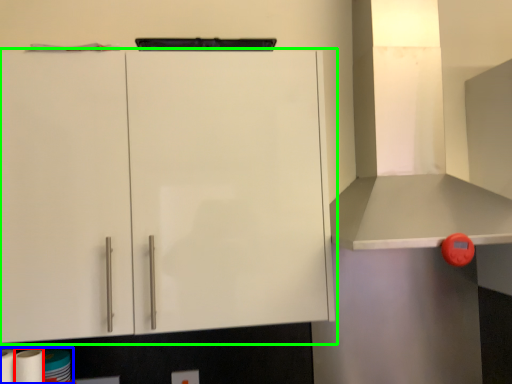
Question: Which object is the closest to the paper towel (highlighted by a red box)? Choose among these: toilet paper (highlighted by a blue box) or cabinetry (highlighted by a green box).

Choices:
 (A) toilet paper
 (B) cabinetry

Answer: (A)